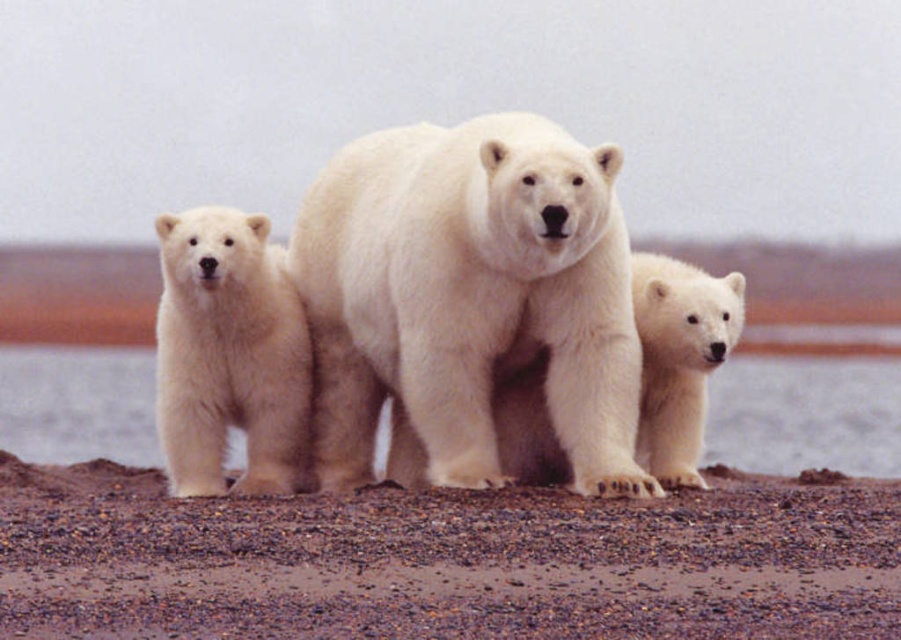
Is white fur water at center shorter than white fluffy bear cub at lower right?

Yes, white fur water at center is shorter than white fluffy bear cub at lower right.

Is white fur water at center taller than white fluffy bear cub at lower right?

Incorrect, white fur water at center's height is not larger of white fluffy bear cub at lower right's.

Who is more forward, (53, 392) or (647, 307)?

Point (647, 307) is more forward.

Find the location of a particular element. The height and width of the screenshot is (640, 901). white fur water at center is located at coordinates (805, 416).

Describe the element at coordinates (470, 298) in the screenshot. This screenshot has height=640, width=901. I see `white fur polar bear at center` at that location.

Does point (535, 342) come behind point (123, 378)?

No.

The height and width of the screenshot is (640, 901). Find the location of `white fur polar bear at center`. white fur polar bear at center is located at coordinates (470, 298).

Measure the distance from brown gravel at center to white fur polar bear at center.

A distance of 7.28 feet exists between brown gravel at center and white fur polar bear at center.

Image resolution: width=901 pixels, height=640 pixels. Identify the location of brown gravel at center. (443, 561).

Identify the location of brown gravel at center. The height and width of the screenshot is (640, 901). (443, 561).